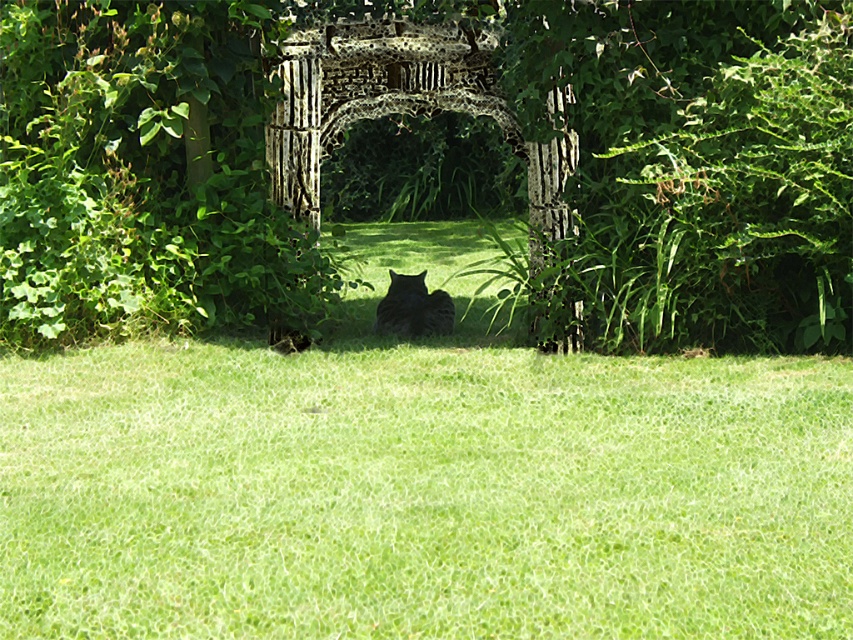
Question: Is green leafy tree at center bigger than green leafy bush at right?

Choices:
 (A) yes
 (B) no

Answer: (B)

Question: Among these objects, which one is nearest to the camera?

Choices:
 (A) green leafy bush at right
 (B) dark gray fur cat at center

Answer: (A)

Question: Is green leafy bush at right positioned in front of wooden lattice archway at center?

Choices:
 (A) yes
 (B) no

Answer: (A)

Question: Does green grass at center appear on the right side of dark gray fur cat at center?

Choices:
 (A) no
 (B) yes

Answer: (B)

Question: Which point is farther to the camera?

Choices:
 (A) dark gray fur cat at center
 (B) green leafy bush at right
 (C) green grass at center
 (D) green leafy tree at center

Answer: (A)

Question: Which object is closer to the camera taking this photo?

Choices:
 (A) dark gray fur cat at center
 (B) green leafy tree at center
 (C) wooden lattice archway at center

Answer: (C)